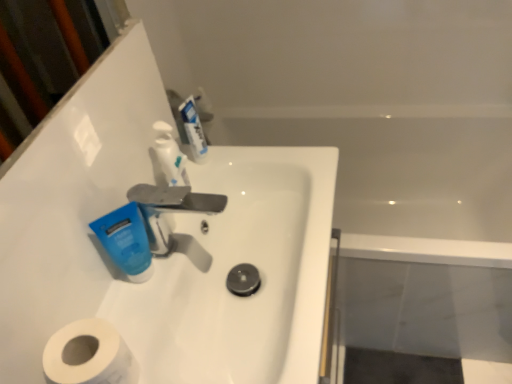
Question: Is white glossy mouthwash at upper center, which is counted as the second mouthwash, starting from the left, thinner than white glossy soap dispenser at upper center?

Choices:
 (A) no
 (B) yes

Answer: (B)

Question: Considering the relative positions of white glossy mouthwash at upper center, marked as the first mouthwash in a back-to-front arrangement, and white glossy soap dispenser at upper center in the image provided, is white glossy mouthwash at upper center, marked as the first mouthwash in a back-to-front arrangement, in front of white glossy soap dispenser at upper center?

Choices:
 (A) no
 (B) yes

Answer: (A)

Question: Considering the relative sizes of white glossy mouthwash at upper center, marked as the first mouthwash in a top-to-bottom arrangement, and white glossy soap dispenser at upper center in the image provided, is white glossy mouthwash at upper center, marked as the first mouthwash in a top-to-bottom arrangement, smaller than white glossy soap dispenser at upper center?

Choices:
 (A) yes
 (B) no

Answer: (A)

Question: Is white glossy mouthwash at upper center, marked as the first mouthwash in a top-to-bottom arrangement, directly adjacent to white glossy soap dispenser at upper center?

Choices:
 (A) yes
 (B) no

Answer: (A)

Question: Considering the relative sizes of white glossy mouthwash at upper center, marked as the first mouthwash in a back-to-front arrangement, and white glossy soap dispenser at upper center in the image provided, is white glossy mouthwash at upper center, marked as the first mouthwash in a back-to-front arrangement, taller than white glossy soap dispenser at upper center?

Choices:
 (A) no
 (B) yes

Answer: (A)

Question: Would you say blue matte tube at center-left, the first mouthwash positioned from the bottom, is to the left or to the right of white glossy sink at center in the picture?

Choices:
 (A) left
 (B) right

Answer: (A)

Question: Do you think blue matte tube at center-left, placed as the first mouthwash when sorted from front to back, is within white glossy sink at center, or outside of it?

Choices:
 (A) outside
 (B) inside

Answer: (A)

Question: From a real-world perspective, is blue matte tube at center-left, arranged as the 2th mouthwash when viewed from the top, physically located above or below white glossy sink at center?

Choices:
 (A) below
 (B) above

Answer: (B)

Question: From the image's perspective, is blue matte tube at center-left, placed as the first mouthwash when sorted from front to back, above or below white glossy sink at center?

Choices:
 (A) below
 (B) above

Answer: (B)

Question: From the image's perspective, relative to blue matte tube at center-left, the first mouthwash positioned from the bottom, is silver metallic faucet at center above or below?

Choices:
 (A) above
 (B) below

Answer: (A)

Question: Considering the relative positions of silver metallic faucet at center and blue matte tube at center-left, arranged as the 2th mouthwash when viewed from the top, in the image provided, is silver metallic faucet at center to the left or to the right of blue matte tube at center-left, arranged as the 2th mouthwash when viewed from the top,?

Choices:
 (A) right
 (B) left

Answer: (A)

Question: Is silver metallic faucet at center spatially inside blue matte tube at center-left, arranged as the 2th mouthwash when viewed from the top, or outside of it?

Choices:
 (A) inside
 (B) outside

Answer: (B)

Question: In terms of height, does silver metallic faucet at center look taller or shorter compared to blue matte tube at center-left, the second mouthwash viewed from the back?

Choices:
 (A) short
 (B) tall

Answer: (B)

Question: Is blue matte tube at center-left, arranged as the 2th mouthwash when viewed from the top, to the left or to the right of white glossy soap dispenser at upper center in the image?

Choices:
 (A) left
 (B) right

Answer: (A)

Question: Do you think blue matte tube at center-left, arranged as the 2th mouthwash when viewed from the top, is within white glossy soap dispenser at upper center, or outside of it?

Choices:
 (A) outside
 (B) inside

Answer: (A)